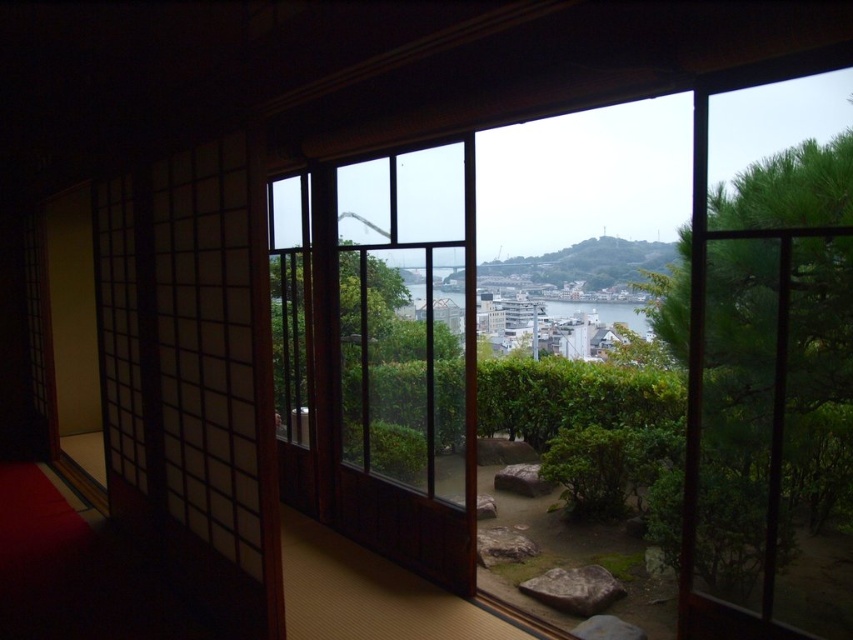
Who is shorter, gray rough stone at lower center or brown rough stone at center?

gray rough stone at lower center is shorter.

Is gray rough stone at lower center smaller than brown rough stone at center?

Yes.

I want to click on gray rough stone at lower center, so click(x=573, y=589).

Who is higher up, transparent glass window at center or brown rough stone at center?

transparent glass window at center is higher up.

The width and height of the screenshot is (853, 640). Describe the element at coordinates (598, 346) in the screenshot. I see `transparent glass window at center` at that location.

Measure the distance between transparent glass window at center and camera.

transparent glass window at center is 6.97 feet from camera.

Where is `transparent glass window at center`? transparent glass window at center is located at coordinates (598, 346).

Image resolution: width=853 pixels, height=640 pixels. In order to click on transparent glass window at center in this screenshot , I will do `click(598, 346)`.

Can you confirm if transparent glass window at center is shorter than gray rough stone at lower center?

No, transparent glass window at center is not shorter than gray rough stone at lower center.

Locate an element on the screen. transparent glass window at center is located at coordinates (598, 346).